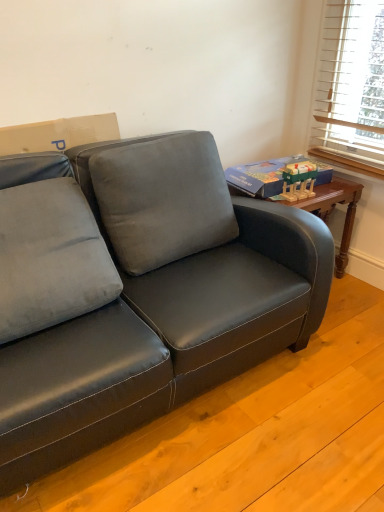
Question: Is suede-like gray pillow at left, arranged as the 2th pillow when viewed from the right, wider or thinner than wooden block toy at upper right?

Choices:
 (A) thin
 (B) wide

Answer: (B)

Question: Based on their positions, is suede-like gray pillow at left, arranged as the 2th pillow when viewed from the right, located to the left or right of wooden block toy at upper right?

Choices:
 (A) right
 (B) left

Answer: (B)

Question: Which object is positioned closest to the satin black couch at lower left?

Choices:
 (A) wooden block toy at upper right
 (B) velvet gray pillow at center, arranged as the first pillow when viewed from the right
 (C) blue cardboard book at upper right
 (D) suede-like gray pillow at left, arranged as the 2th pillow when viewed from the right

Answer: (B)

Question: Considering the real-world distances, which object is farthest from the suede-like gray pillow at left, acting as the 1th pillow starting from the left?

Choices:
 (A) blue cardboard book at upper right
 (B) velvet gray pillow at center, arranged as the first pillow when viewed from the right
 (C) satin black couch at lower left
 (D) wooden block toy at upper right

Answer: (D)